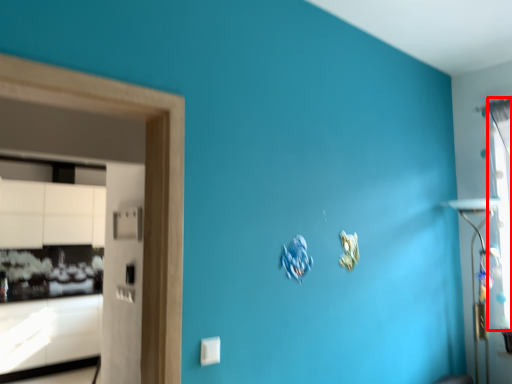
Question: From the image's perspective, where is window (annotated by the red box) located relative to cabinetry?

Choices:
 (A) above
 (B) below

Answer: (A)